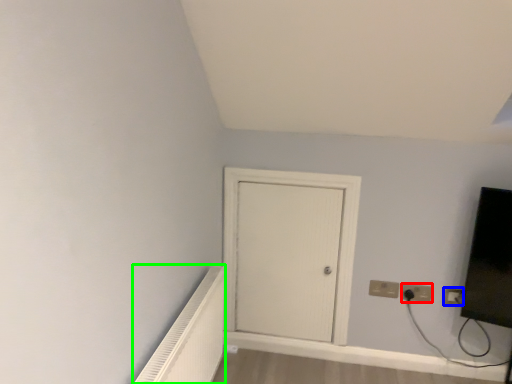
Question: Estimate the real-world distances between objects in this image. Which object is closer to electric outlet (highlighted by a red box), electric outlet (highlighted by a blue box) or radiator (highlighted by a green box)?

Choices:
 (A) electric outlet
 (B) radiator

Answer: (A)